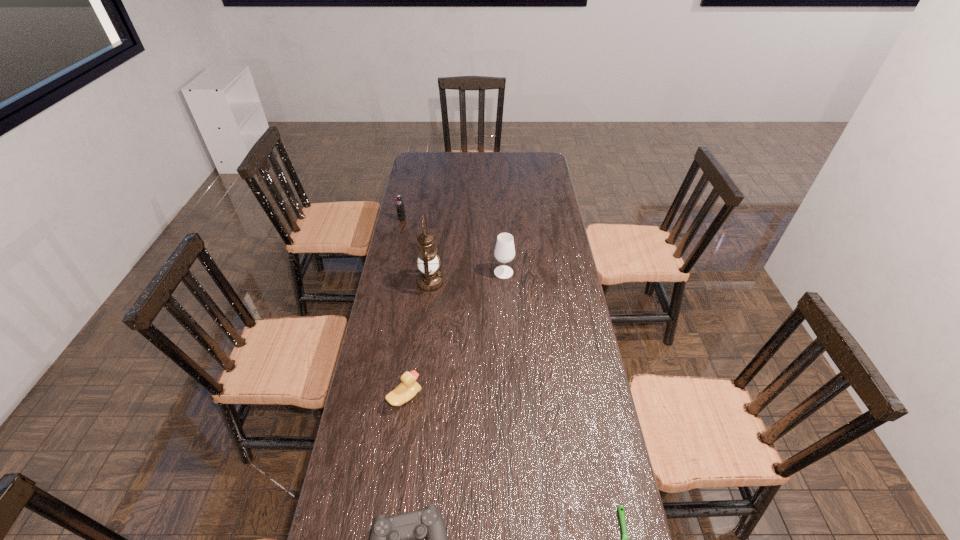
Locate an element on the screen. This screenshot has height=540, width=960. vacant region between the third nearest object and the farthest object is located at coordinates (403, 308).

You are a GUI agent. You are given a task and a screenshot of the screen. Output one action in this format:
    pyautogui.click(x=<x>, y=<y>)
    Task: Click on the empty space between the fifth shortest object and the fourth farthest object
    This screenshot has height=540, width=960.
    Given the screenshot: What is the action you would take?
    pyautogui.click(x=454, y=335)

You are a GUI agent. You are given a task and a screenshot of the screen. Output one action in this format:
    pyautogui.click(x=<x>, y=<y>)
    Task: Click on the unoccupied area between the tallest object and the glass
    
    Given the screenshot: What is the action you would take?
    pyautogui.click(x=467, y=278)

This screenshot has height=540, width=960. I want to click on object that is the fourth closest to the leftmost object, so click(397, 539).

Select which object appears as the second closest to the second shortest object. Please provide its 2D coordinates. Your answer should be formatted as a tuple, i.e. [(x, y)], where the tuple contains the x and y coordinates of a point satisfying the conditions above.

[(621, 511)]

This screenshot has width=960, height=540. I want to click on free spot that satisfies the following two spatial constraints: 1. on the front label of the tallest object; 2. on the right side of the third tallest object, so click(389, 283).